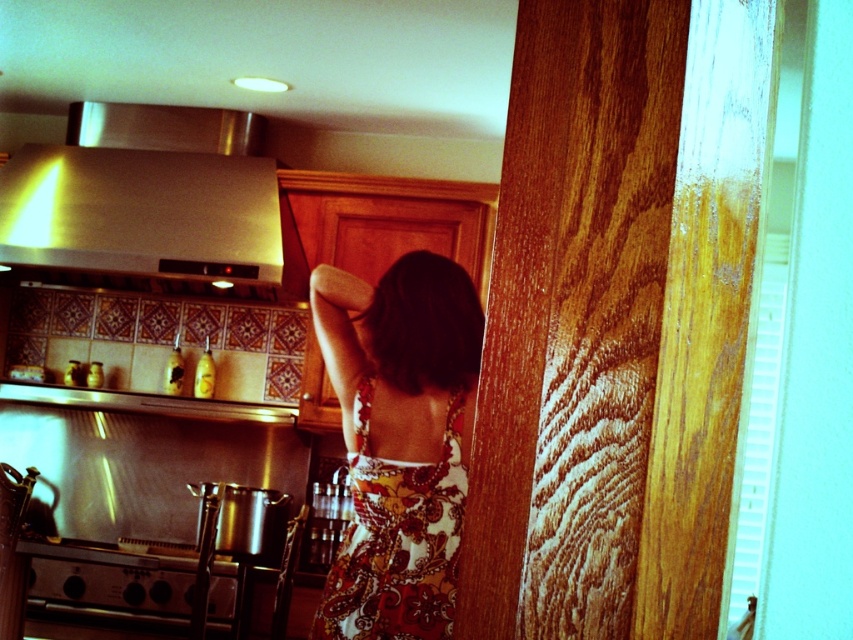
Question: Does stainless steel exhaust hood at upper left have a greater width compared to floral print fabric dress at center?

Choices:
 (A) no
 (B) yes

Answer: (B)

Question: Which of these objects is positioned farthest from the stainless steel exhaust hood at upper left?

Choices:
 (A) stainless steel oven at lower left
 (B) floral print fabric dress at center

Answer: (B)

Question: Which of the following is the farthest from the observer?

Choices:
 (A) floral print fabric dress at center
 (B) stainless steel exhaust hood at upper left

Answer: (B)

Question: Is floral print fabric dress at center above stainless steel oven at lower left?

Choices:
 (A) no
 (B) yes

Answer: (B)

Question: Which point is farther from the camera taking this photo?

Choices:
 (A) (53, 216)
 (B) (70, 582)

Answer: (A)

Question: Can you confirm if stainless steel exhaust hood at upper left is bigger than stainless steel oven at lower left?

Choices:
 (A) no
 (B) yes

Answer: (B)